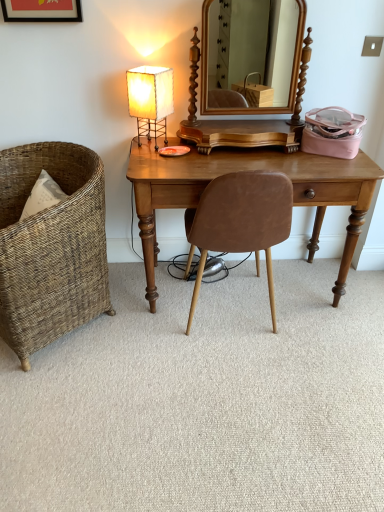
At what (x,y) coordinates should I click in order to perform the action: click on free spot above carpet at center (from a real-world perspective). Please return your answer as a coordinate pair (x, y). Looking at the image, I should click on (230, 353).